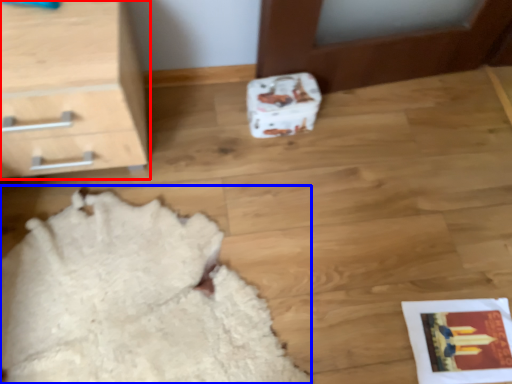
Question: Which object is further to the camera taking this photo, chest of drawers (highlighted by a red box) or blanket (highlighted by a blue box)?

Choices:
 (A) chest of drawers
 (B) blanket

Answer: (B)